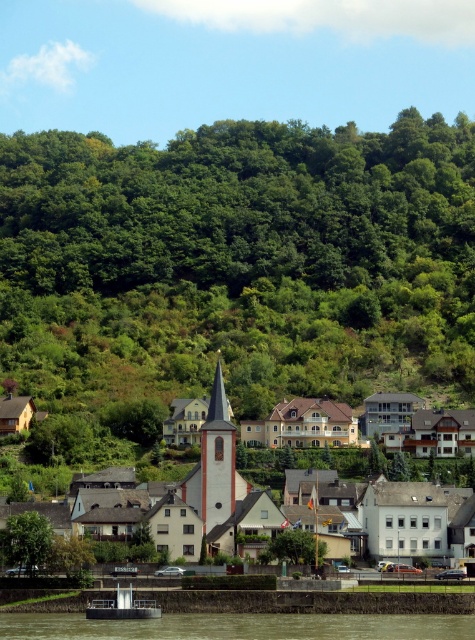
Question: Can you confirm if green leafy hillside at upper center is positioned to the right of white plastic boat at lower left?

Choices:
 (A) yes
 (B) no

Answer: (A)

Question: Which point appears farthest from the camera in this image?

Choices:
 (A) (160, 609)
 (B) (469, 618)
 (C) (41, 541)

Answer: (C)

Question: Which of the following is the closest to the observer?

Choices:
 (A) (43, 560)
 (B) (433, 131)

Answer: (A)

Question: Does green leafy hillside at upper center have a lesser width compared to green leafy tree at lower left?

Choices:
 (A) no
 (B) yes

Answer: (A)

Question: Is white stucco church at center smaller than green leafy tree at lower left?

Choices:
 (A) yes
 (B) no

Answer: (B)

Question: Which object is positioned farthest from the green leafy hillside at upper center?

Choices:
 (A) green leafy tree at center
 (B) white stucco church at center

Answer: (A)